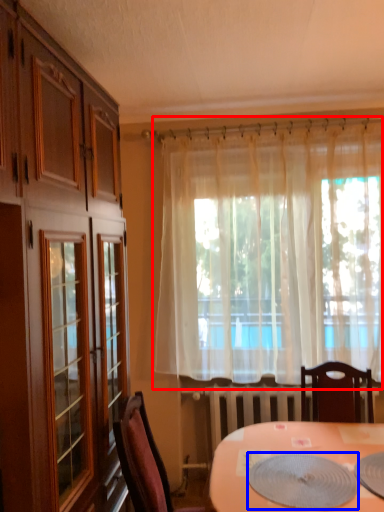
Question: Which object is closer to the camera taking this photo, curtain (highlighted by a red box) or platter (highlighted by a blue box)?

Choices:
 (A) curtain
 (B) platter

Answer: (B)